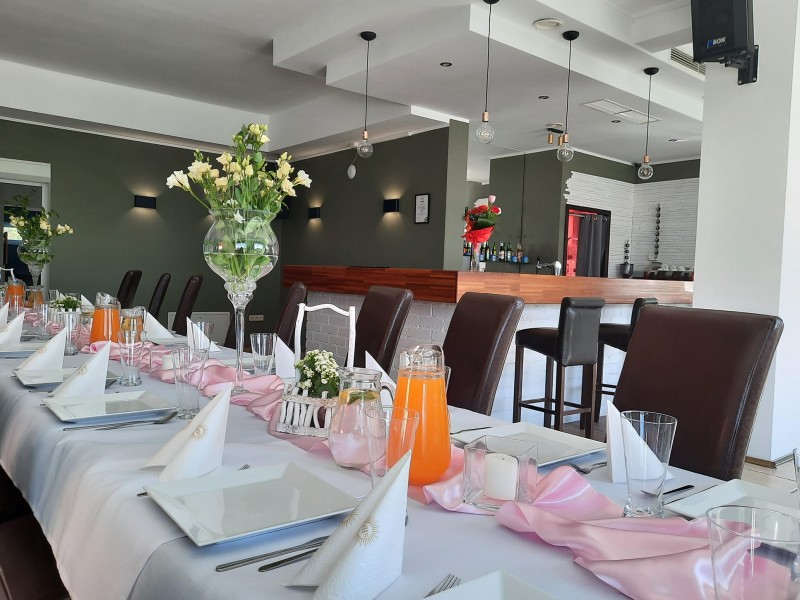
You are a GUI agent. You are given a task and a screenshot of the screen. Output one action in this format:
    pyautogui.click(x=<x>, y=<y>)
    Task: Click on the chairs
    Image resolution: width=800 pixels, height=600 pixels.
    Given the screenshot: What is the action you would take?
    pyautogui.click(x=714, y=376), pyautogui.click(x=482, y=332), pyautogui.click(x=386, y=299), pyautogui.click(x=294, y=286), pyautogui.click(x=233, y=328), pyautogui.click(x=188, y=278), pyautogui.click(x=160, y=279), pyautogui.click(x=126, y=279)